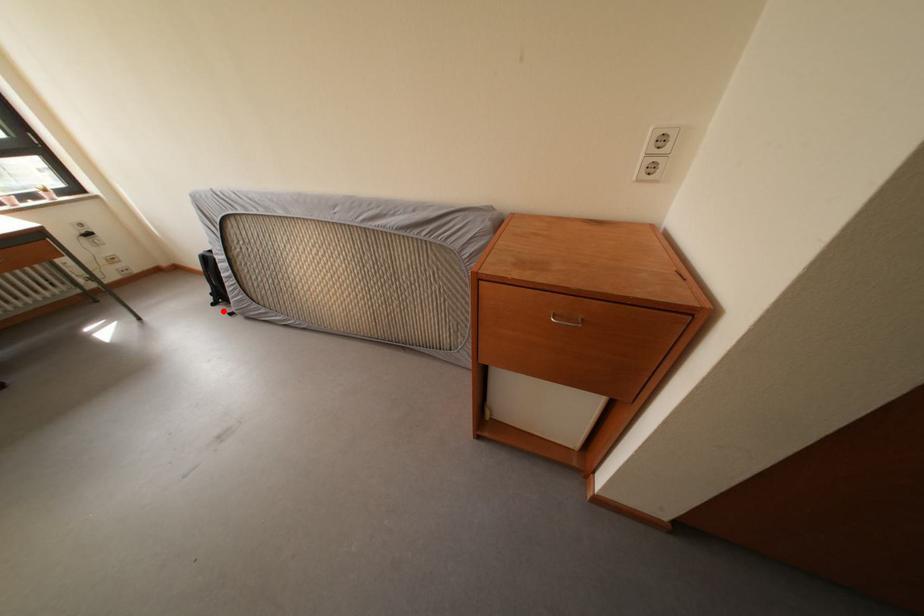
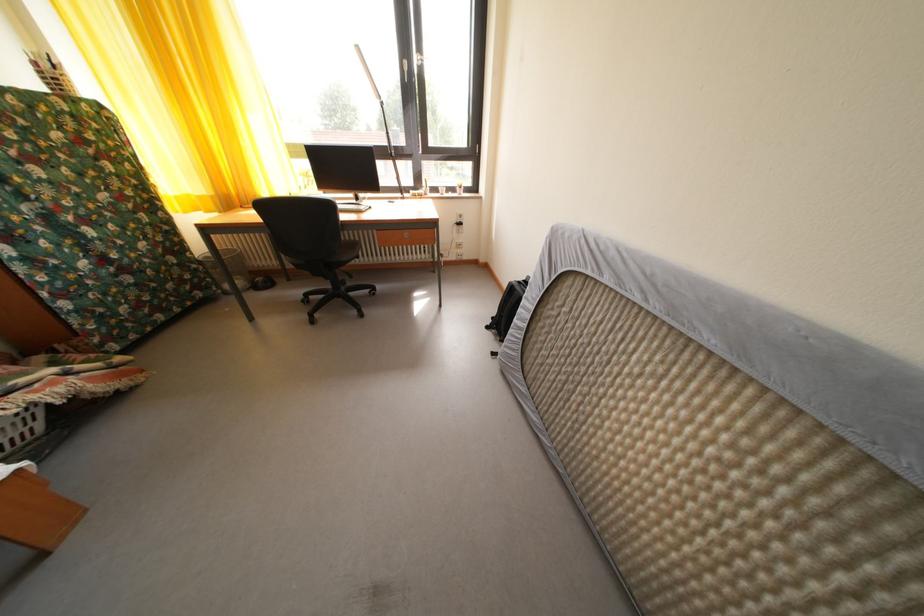
In the second image, find the point that corresponds to the highlighted location in the first image.

(496, 334)